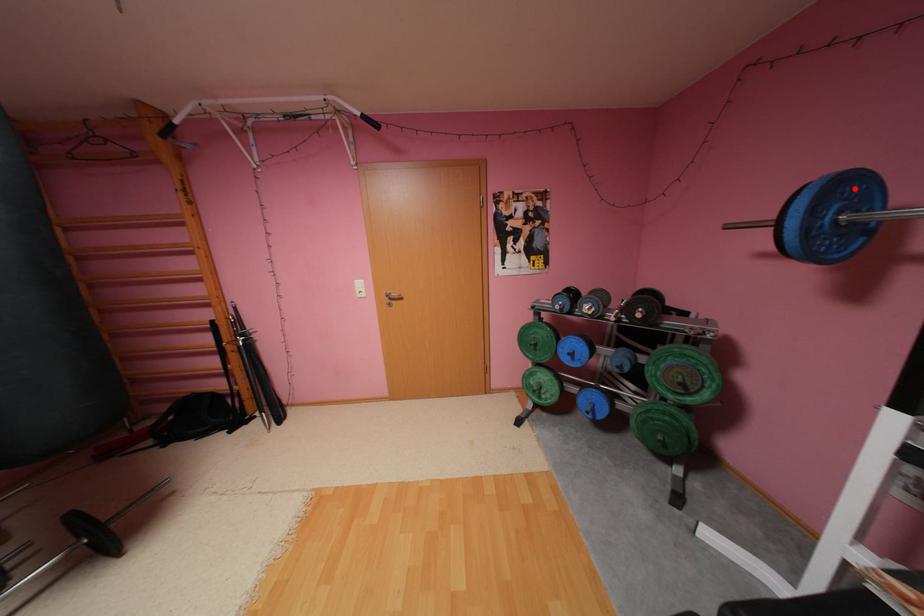
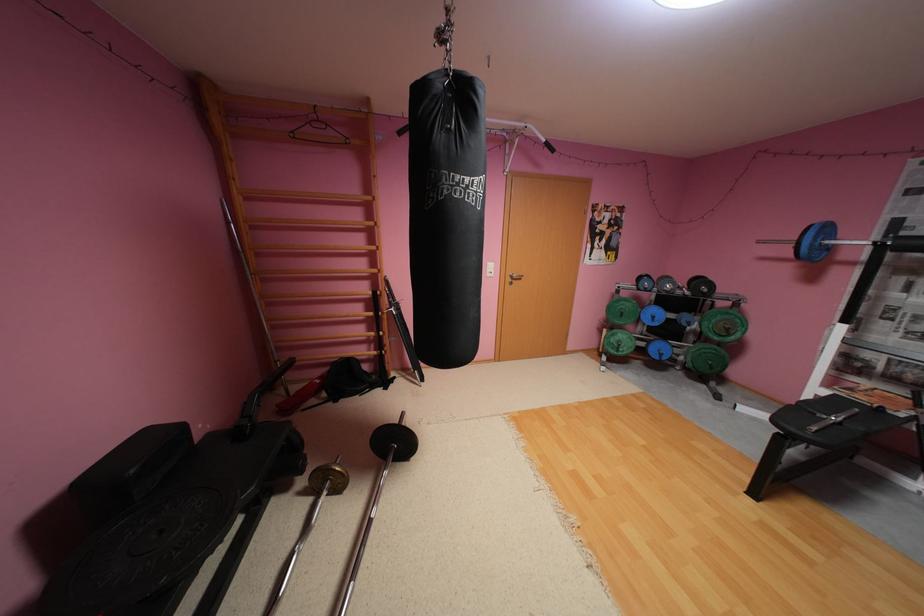
In the second image, find the point that corresponds to the highlighted location in the first image.

(835, 229)